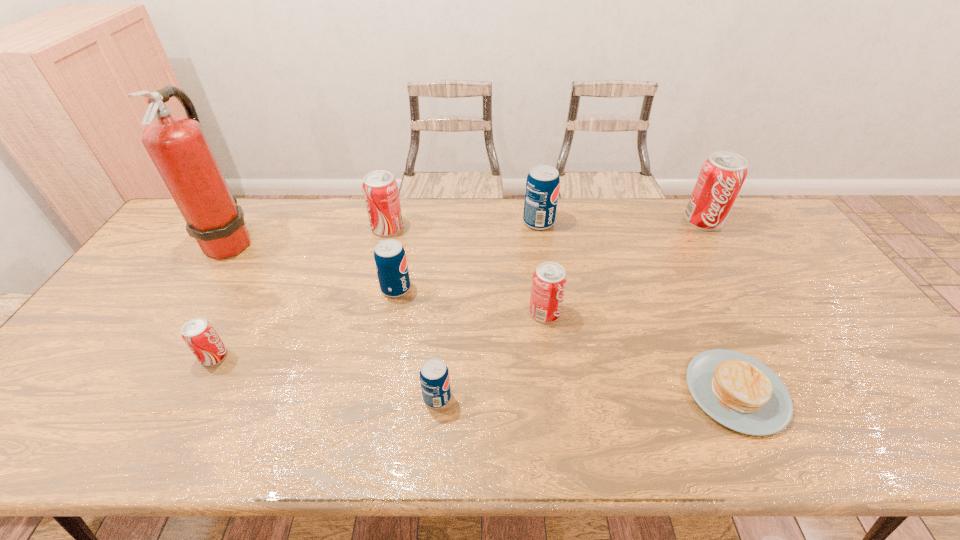
The image size is (960, 540). Find the location of `free location that satisfies the following two spatial constraints: 1. at the nozzle of the second blue pop from left to right; 2. on the left side of the fire extinguisher`. free location that satisfies the following two spatial constraints: 1. at the nozzle of the second blue pop from left to right; 2. on the left side of the fire extinguisher is located at coordinates (131, 397).